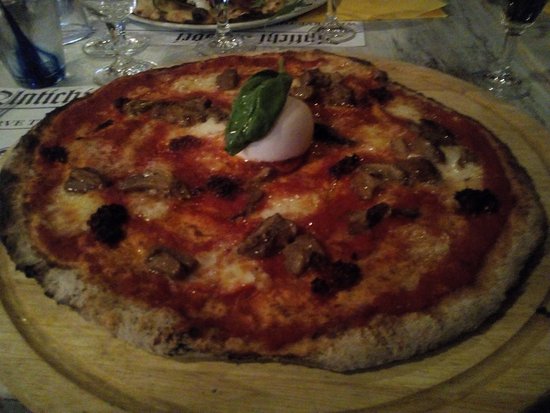
Identify the location of glass base. The image size is (550, 413). (99, 45).